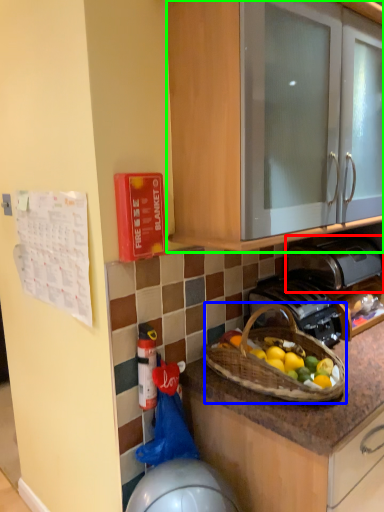
Question: Which object is positioned farthest from toaster (highlighted by a red box)? Select from picnic basket (highlighted by a blue box) and cabinetry (highlighted by a green box).

Choices:
 (A) picnic basket
 (B) cabinetry

Answer: (B)